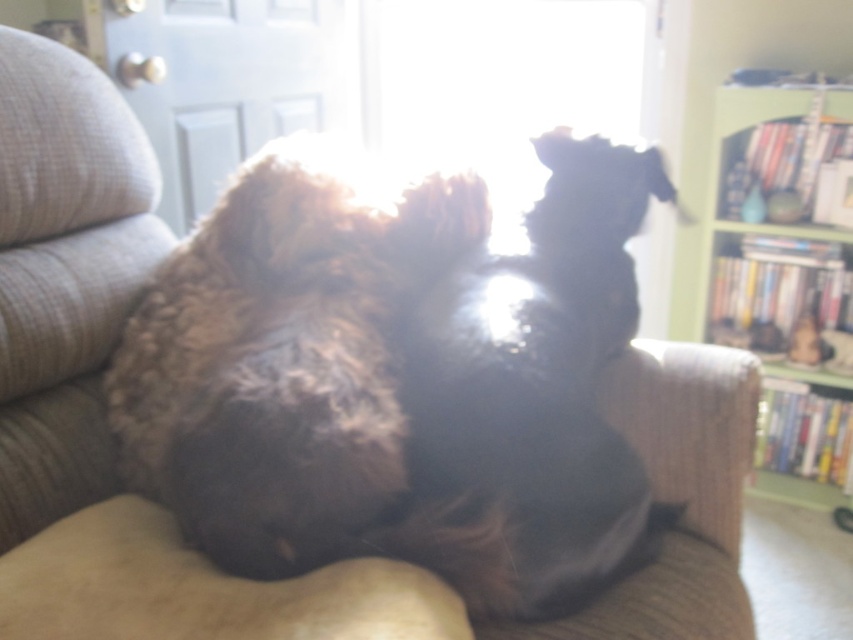
Is fuzzy brown dog at center positioned behind green wooden bookshelf at right?

No, fuzzy brown dog at center is closer to the viewer.

Image resolution: width=853 pixels, height=640 pixels. Describe the element at coordinates (283, 356) in the screenshot. I see `fuzzy brown dog at center` at that location.

Is point (440, 269) positioned in front of point (848, 104)?

Yes, point (440, 269) is closer to viewer.

You are a GUI agent. You are given a task and a screenshot of the screen. Output one action in this format:
    pyautogui.click(x=<x>, y=<y>)
    Task: Click on the fuzzy brown dog at center
    The image size is (853, 640).
    Given the screenshot: What is the action you would take?
    pyautogui.click(x=283, y=356)

Between shiny black dog at center and green wooden bookshelf at right, which one is positioned lower?

shiny black dog at center

Does shiny black dog at center have a lesser height compared to green wooden bookshelf at right?

Indeed, shiny black dog at center has a lesser height compared to green wooden bookshelf at right.

I want to click on shiny black dog at center, so (x=531, y=397).

Between fuzzy brown dog at center and shiny black dog at center, which one has less height?

Standing shorter between the two is fuzzy brown dog at center.

Can you confirm if fuzzy brown dog at center is thinner than shiny black dog at center?

No, fuzzy brown dog at center is not thinner than shiny black dog at center.

Between point (267, 467) and point (519, 456), which one is positioned behind?

The point (519, 456) is more distant.

At what (x,y) coordinates should I click in order to perform the action: click on fuzzy brown dog at center. Please return your answer as a coordinate pair (x, y). The width and height of the screenshot is (853, 640). Looking at the image, I should click on (283, 356).